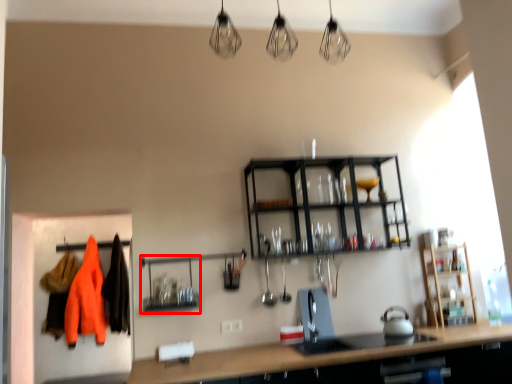
Question: From the image's perspective, considering the relative positions of shelf (annotated by the red box) and clothing in the image provided, where is shelf (annotated by the red box) located with respect to the staircase?

Choices:
 (A) above
 (B) below

Answer: (A)